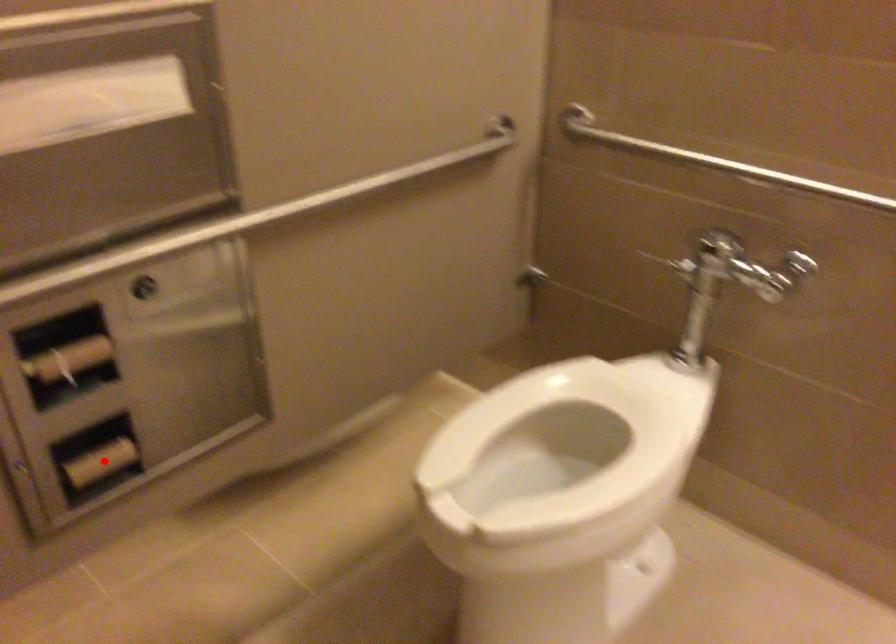
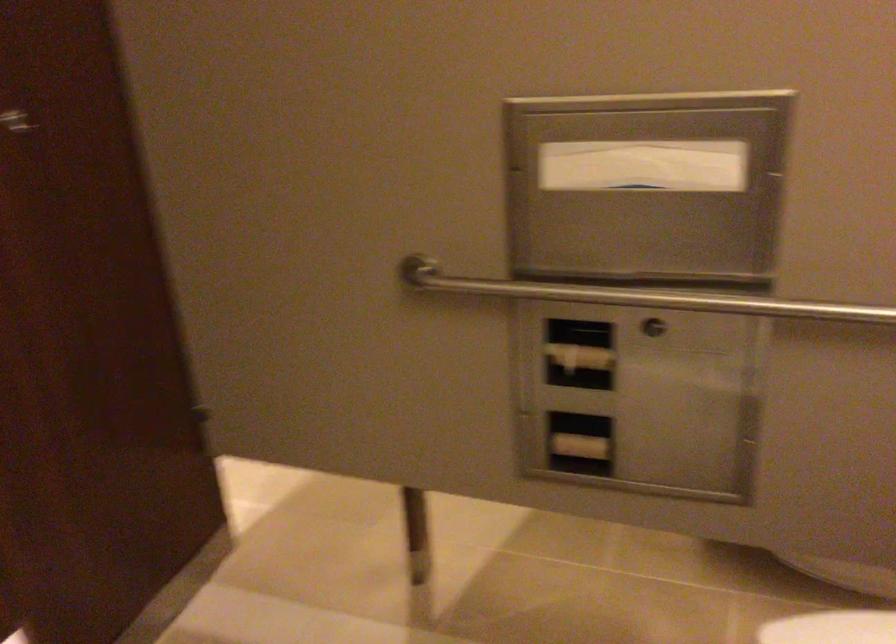
Question: I am providing you with two images of the same scene from different viewpoints. A red point is shown in image1. For the corresponding object point in image2, is it positioned nearer or farther from the camera?

Choices:
 (A) Nearer
 (B) Farther

Answer: (B)